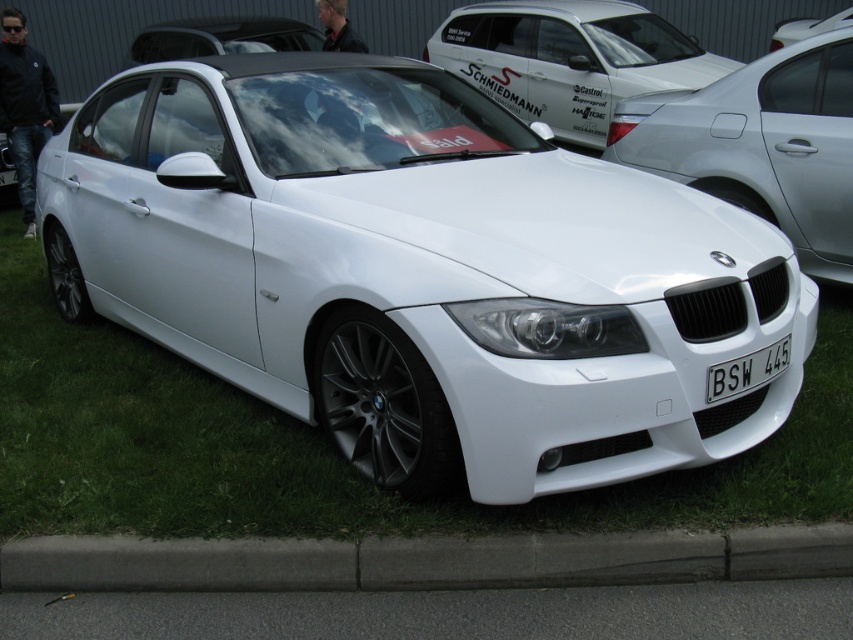
You are a delivery robot with a width of 1.2 meters. You need to move from the gray concrete curb at lower center to the white glossy sedan at center. Is there enough space between them for you to pass through?

The distance between the gray concrete curb at lower center and the white glossy sedan at center is 3.12 meters. Since the robot is 1.2 meters wide, there is sufficient space to pass through as the distance is greater than the robot width.

You are standing in front of the white BMW sedan parked on grass. There is a gray concrete curb at lower center marked by point [421,561]. If you want to walk to the curb from the car, which direction should you move relative to the car?

The gray concrete curb at lower center marked by point [421,561] is located in the direction of the lower center relative to the car. Therefore, you should move towards the lower center direction to reach the curb from the car.

You are standing at the edge of the grass where the white BMW sedan is parked. You want to place a small traffic cone exactly where the gray concrete curb at lower center is located. What are the coordinates where you should place the cone?

The gray concrete curb at lower center is located at coordinates point (421, 561), so you should place the cone there.